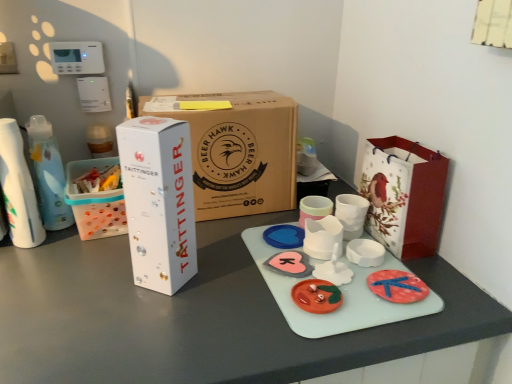
Where is `brown cardboard box at center, the second box in the front-to-back sequence`? This screenshot has width=512, height=384. brown cardboard box at center, the second box in the front-to-back sequence is located at coordinates (239, 152).

Measure the distance between point (201, 164) and camera.

3.48 feet.

This screenshot has width=512, height=384. Describe the element at coordinates (284, 236) in the screenshot. I see `blue rubber heart at center, which appears as the fourth toy when viewed from the front` at that location.

At what (x,y) coordinates should I click in order to perform the action: click on white paper bag with red bird design at right. Please return your answer as a coordinate pair (x, y). The image size is (512, 384). Looking at the image, I should click on (404, 195).

This screenshot has width=512, height=384. I want to click on white cardboard box at left, so click(95, 202).

Does white glossy box at left, which ranks as the second box in back-to-front order, turn towards white glossy table at center?

No, white glossy box at left, which ranks as the second box in back-to-front order, does not turn towards white glossy table at center.

Considering the positions of objects white glossy box at left, which ranks as the second box in back-to-front order, and white glossy table at center in the image provided, who is more to the right, white glossy box at left, which ranks as the second box in back-to-front order, or white glossy table at center?

From the viewer's perspective, white glossy box at left, which ranks as the second box in back-to-front order, appears more on the right side.

Considering the sizes of objects white glossy box at left, marked as the 1th box in a front-to-back arrangement, and white glossy table at center in the image provided, who is shorter, white glossy box at left, marked as the 1th box in a front-to-back arrangement, or white glossy table at center?

With less height is white glossy box at left, marked as the 1th box in a front-to-back arrangement.

Would you consider white glossy box at left, marked as the 1th box in a front-to-back arrangement, to be distant from white glossy table at center?

No, there isn't a large distance between white glossy box at left, marked as the 1th box in a front-to-back arrangement, and white glossy table at center.

Considering the sizes of objects white cardboard box at left and matte plastic toy at center, the 4th toy from the back, in the image provided, who is shorter, white cardboard box at left or matte plastic toy at center, the 4th toy from the back,?

With less height is matte plastic toy at center, the 4th toy from the back.

How far apart are white cardboard box at left and matte plastic toy at center, the 4th toy from the back?

21.92 inches.

Does white cardboard box at left have a smaller size compared to matte plastic toy at center, the 4th toy from the back?

Actually, white cardboard box at left might be larger than matte plastic toy at center, the 4th toy from the back.

Is white cardboard box at left placed right next to matte plastic toy at center, the 4th toy from the back?

white cardboard box at left and matte plastic toy at center, the 4th toy from the back, are not in contact.

Are white cardboard box at left and blue rubber heart at center, the first toy from the back, making contact?

No, white cardboard box at left is not next to blue rubber heart at center, the first toy from the back.

From the image's perspective, who appears lower, white cardboard box at left or blue rubber heart at center, which appears as the fourth toy when viewed from the front?

blue rubber heart at center, which appears as the fourth toy when viewed from the front.

Is blue rubber heart at center, which appears as the fourth toy when viewed from the front, located within white cardboard box at left?

No.

Considering the sizes of objects white paper bag with red bird design at right and white glossy box at left, which ranks as the second box in back-to-front order, in the image provided, who is thinner, white paper bag with red bird design at right or white glossy box at left, which ranks as the second box in back-to-front order,?

Thinner between the two is white paper bag with red bird design at right.

From a real-world perspective, is white paper bag with red bird design at right on white glossy box at left, which ranks as the second box in back-to-front order?

No, from a real-world perspective, white paper bag with red bird design at right is not above white glossy box at left, which ranks as the second box in back-to-front order.

Is white paper bag with red bird design at right in front of or behind white glossy box at left, marked as the 1th box in a front-to-back arrangement, in the image?

In the image, white paper bag with red bird design at right appears behind white glossy box at left, marked as the 1th box in a front-to-back arrangement.

Is brown cardboard box at center, the 1th box viewed from the back, taller or shorter than white glossy box at left, marked as the 1th box in a front-to-back arrangement?

In the image, brown cardboard box at center, the 1th box viewed from the back, appears to be shorter than white glossy box at left, marked as the 1th box in a front-to-back arrangement.

Which is correct: brown cardboard box at center, the second box in the front-to-back sequence, is inside white glossy box at left, marked as the 1th box in a front-to-back arrangement, or outside of it?

brown cardboard box at center, the second box in the front-to-back sequence, exists outside the volume of white glossy box at left, marked as the 1th box in a front-to-back arrangement.

Who is taller, white paper bag with red bird design at right or matte plastic toy at center, acting as the 1th toy starting from the front?

white paper bag with red bird design at right is taller.

Are white paper bag with red bird design at right and matte plastic toy at center, the 4th toy from the back, making contact?

No, white paper bag with red bird design at right is not touching matte plastic toy at center, the 4th toy from the back.

Between point (370, 203) and point (319, 299), which one is positioned in front?

The point (319, 299) is more forward.

Is white glossy table at center further to camera compared to brown cardboard box at center, the 1th box viewed from the back?

No, the depth of white glossy table at center is less than that of brown cardboard box at center, the 1th box viewed from the back.

Does white glossy table at center touch brown cardboard box at center, the 1th box viewed from the back?

white glossy table at center and brown cardboard box at center, the 1th box viewed from the back, are clearly separated.

From a real-world perspective, is white glossy table at center on brown cardboard box at center, the 1th box viewed from the back?

No, from a real-world perspective, white glossy table at center is not on top of brown cardboard box at center, the 1th box viewed from the back.

The height and width of the screenshot is (384, 512). I want to click on the 2nd box located above the white glossy table at center (from a real-world perspective), so click(159, 201).

The height and width of the screenshot is (384, 512). Find the location of `toy that is the 3rd one when counting forward from the white cardboard box at left`. toy that is the 3rd one when counting forward from the white cardboard box at left is located at coordinates (316, 296).

When comparing their distances from white glossy table at center, does brown cardboard box at center, the 1th box viewed from the back, or blue rubber heart at center, which appears as the fourth toy when viewed from the front, seem closer?

brown cardboard box at center, the 1th box viewed from the back, is closer to white glossy table at center.

When comparing their distances from white glossy box at left, which ranks as the second box in back-to-front order, does white paper bag with red bird design at right or pink matte heart at center, the 3th toy in the front-to-back sequence, seem closer?

The object closer to white glossy box at left, which ranks as the second box in back-to-front order, is pink matte heart at center, the 3th toy in the front-to-back sequence.

Estimate the real-world distances between objects in this image. Which object is closer to white paper bag with red bird design at right, brown cardboard box at center, the second box in the front-to-back sequence, or white cardboard box at left?

Based on the image, brown cardboard box at center, the second box in the front-to-back sequence, appears to be nearer to white paper bag with red bird design at right.

Considering their positions, is brown cardboard box at center, the second box in the front-to-back sequence, positioned further to white paper bag with red bird design at right than blue rubber heart at center, which appears as the fourth toy when viewed from the front?

brown cardboard box at center, the second box in the front-to-back sequence, lies further to white paper bag with red bird design at right than the other object.

Based on their spatial positions, is brown cardboard box at center, the 1th box viewed from the back, or white glossy cup at center, which is counted as the 3th toy, starting from the back, closer to white glossy box at left, which ranks as the second box in back-to-front order?

brown cardboard box at center, the 1th box viewed from the back, is closer to white glossy box at left, which ranks as the second box in back-to-front order.

Looking at the image, which one is located further to blue rubber heart at center, the first toy from the back, pink matte heart at center, arranged as the 2th toy when viewed from the back, or white glossy box at left, which ranks as the second box in back-to-front order?

white glossy box at left, which ranks as the second box in back-to-front order, lies further to blue rubber heart at center, the first toy from the back, than the other object.

Looking at the image, which one is located closer to white glossy cup at center, which is counted as the 3th toy, starting from the back, pink matte heart at center, arranged as the 2th toy when viewed from the back, or brown cardboard box at center, the 1th box viewed from the back?

pink matte heart at center, arranged as the 2th toy when viewed from the back.

From the image, which object appears to be farther from white glossy cup at center, the second toy positioned from the front, white glossy box at left, marked as the 1th box in a front-to-back arrangement, or white glossy table at center?

Among the two, white glossy box at left, marked as the 1th box in a front-to-back arrangement, is located further to white glossy cup at center, the second toy positioned from the front.

Image resolution: width=512 pixels, height=384 pixels. In order to click on box located between white glossy box at left, which ranks as the second box in back-to-front order, and blue rubber heart at center, the first toy from the back, in the depth direction in this screenshot , I will do `click(239, 152)`.

Find the location of a particular element. The height and width of the screenshot is (384, 512). paper bag between brown cardboard box at center, the second box in the front-to-back sequence, and white glossy table at center in the up-down direction is located at coordinates (404, 195).

Where is `box that lies between white cardboard box at left and white glossy table at center from top to bottom`? box that lies between white cardboard box at left and white glossy table at center from top to bottom is located at coordinates (159, 201).

Where is `cardboard box located between white glossy table at center and blue rubber heart at center, the first toy from the back, in the depth direction`? The width and height of the screenshot is (512, 384). cardboard box located between white glossy table at center and blue rubber heart at center, the first toy from the back, in the depth direction is located at coordinates (95, 202).